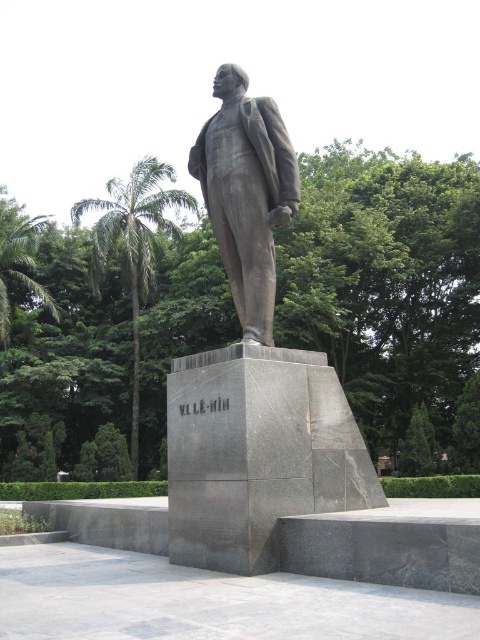
Looking at this image, who is lower down, polished bronze statue at center or bronze statue at center?

polished bronze statue at center is below.

Between polished bronze statue at center and bronze statue at center, which one has more height?

With more height is polished bronze statue at center.

I want to click on polished bronze statue at center, so click(x=253, y=369).

Identify the location of polished bronze statue at center. [x=253, y=369].